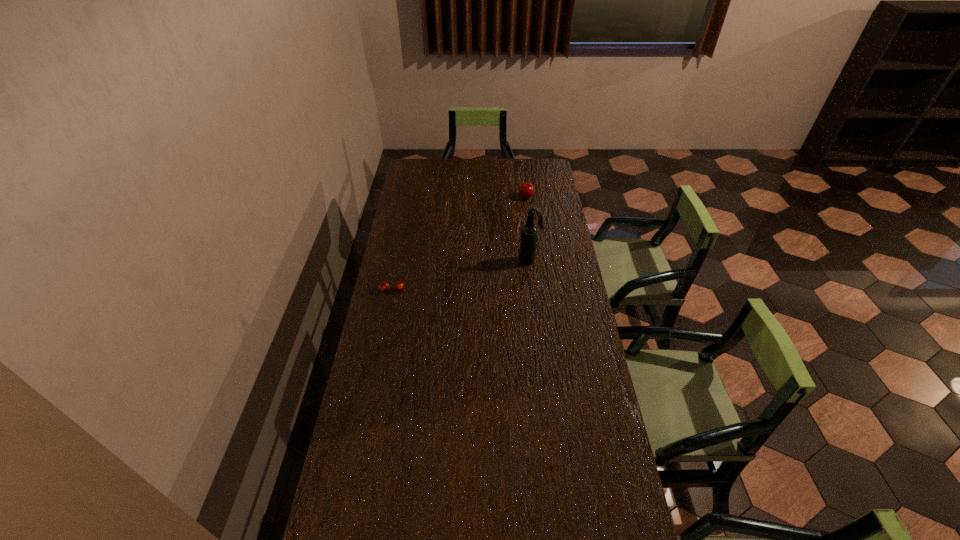
Locate which object ranks second in proximity to the tallest object. Please provide its 2D coordinates. Your answer should be formatted as a tuple, i.e. [(x, y)], where the tuple contains the x and y coordinates of a point satisfying the conditions above.

[(383, 286)]

Find the location of a particular element. The image size is (960, 540). blank area in the image that satisfies the following two spatial constraints: 1. on the back side of the farthest object; 2. on the left side of the beer bottle is located at coordinates (522, 197).